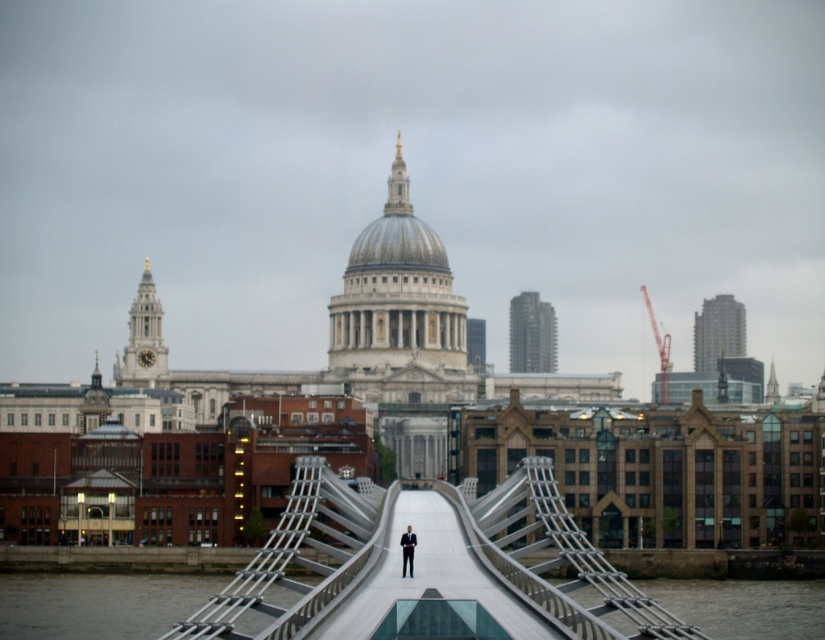
Between metallic silver suspension bridge at center and dark suit at center, which one has less height?

dark suit at center is shorter.

The height and width of the screenshot is (640, 825). What do you see at coordinates (427, 566) in the screenshot?
I see `metallic silver suspension bridge at center` at bounding box center [427, 566].

Who is more distant from viewer, (x=468, y=545) or (x=402, y=548)?

Point (x=468, y=545)

At what (x,y) coordinates should I click in order to perform the action: click on metallic silver suspension bridge at center. Please return your answer as a coordinate pair (x, y). The width and height of the screenshot is (825, 640). Looking at the image, I should click on (427, 566).

Is smooth concrete bridge at center shorter than dark suit at center?

Indeed, smooth concrete bridge at center has a lesser height compared to dark suit at center.

Image resolution: width=825 pixels, height=640 pixels. Find the location of `smooth concrete bridge at center`. smooth concrete bridge at center is located at coordinates (429, 573).

At what (x,y) coordinates should I click in order to perform the action: click on smooth concrete bridge at center. Please return your answer as a coordinate pair (x, y). The height and width of the screenshot is (640, 825). Looking at the image, I should click on (429, 573).

Is point (330, 579) more distant than point (446, 522)?

No, it is not.

Between metallic silver suspension bridge at center and smooth concrete bridge at center, which one appears on the right side from the viewer's perspective?

smooth concrete bridge at center

Where is `metallic silver suspension bridge at center`? metallic silver suspension bridge at center is located at coordinates (427, 566).